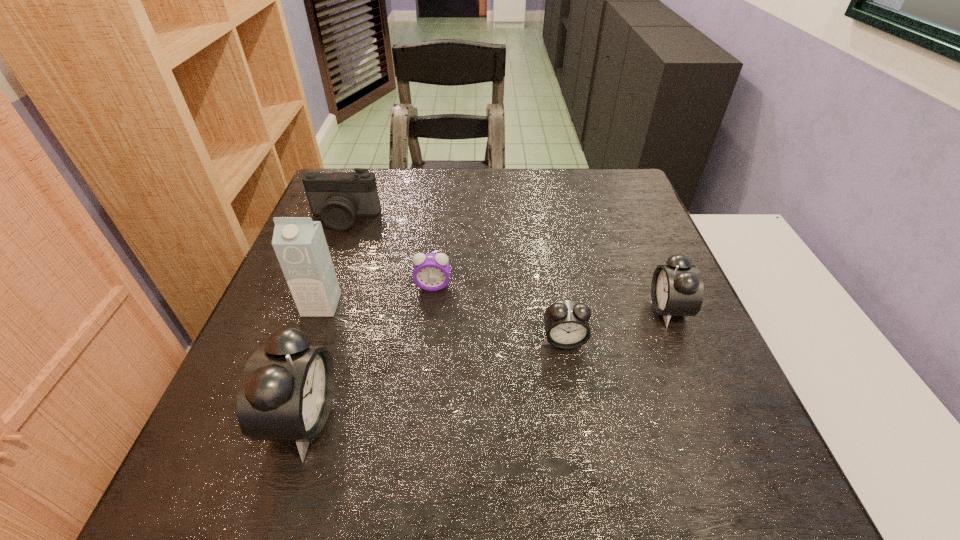
The width and height of the screenshot is (960, 540). Find the location of `vacant space situated 0.100m on the front side of the third farthest alarm clock`. vacant space situated 0.100m on the front side of the third farthest alarm clock is located at coordinates (573, 397).

Locate an element on the screen. vacant region located on the front side of the rightmost object is located at coordinates (589, 309).

I want to click on vacant space located on the front side of the rightmost object, so click(x=492, y=309).

Where is `vacant position located 0.330m on the front side of the rightmost object`? The width and height of the screenshot is (960, 540). vacant position located 0.330m on the front side of the rightmost object is located at coordinates (495, 309).

Where is `free space located 0.200m on the front label of the carton`? The width and height of the screenshot is (960, 540). free space located 0.200m on the front label of the carton is located at coordinates (286, 402).

Identify the location of blank area located 0.350m at the lens of the camera. (300, 336).

The height and width of the screenshot is (540, 960). What are the coordinates of `free space located on the face of the second alarm clock from left to right` in the screenshot? It's located at (420, 409).

The image size is (960, 540). I want to click on object that is at the far edge, so click(x=338, y=197).

The width and height of the screenshot is (960, 540). I want to click on object present at the near edge, so click(x=286, y=390).

Identify the location of alarm clock at the left edge. This screenshot has width=960, height=540. (286, 390).